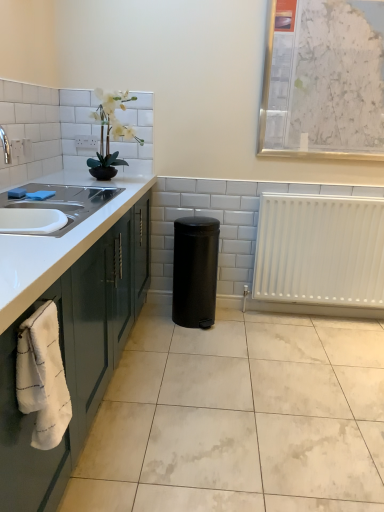
The width and height of the screenshot is (384, 512). I want to click on vacant space to the right of black matte trash can at center, so click(x=241, y=325).